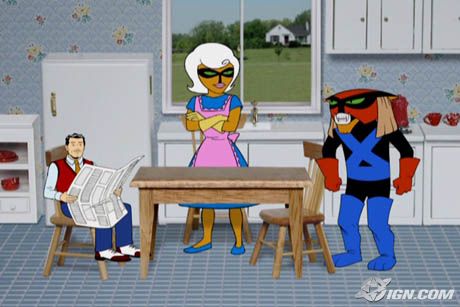
The height and width of the screenshot is (307, 460). I want to click on cabinets, so click(356, 27), click(403, 31), click(450, 26), click(438, 184), click(280, 156), click(179, 155).